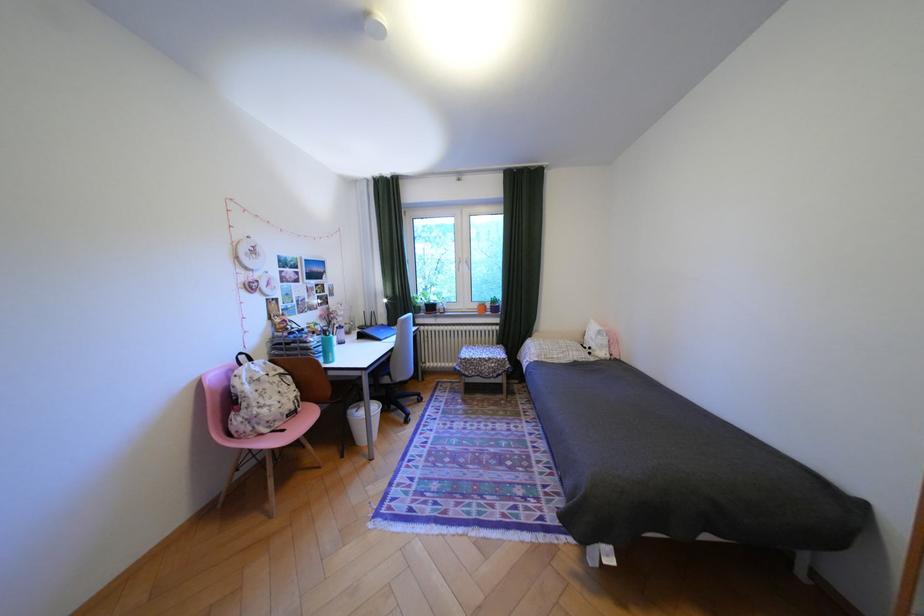
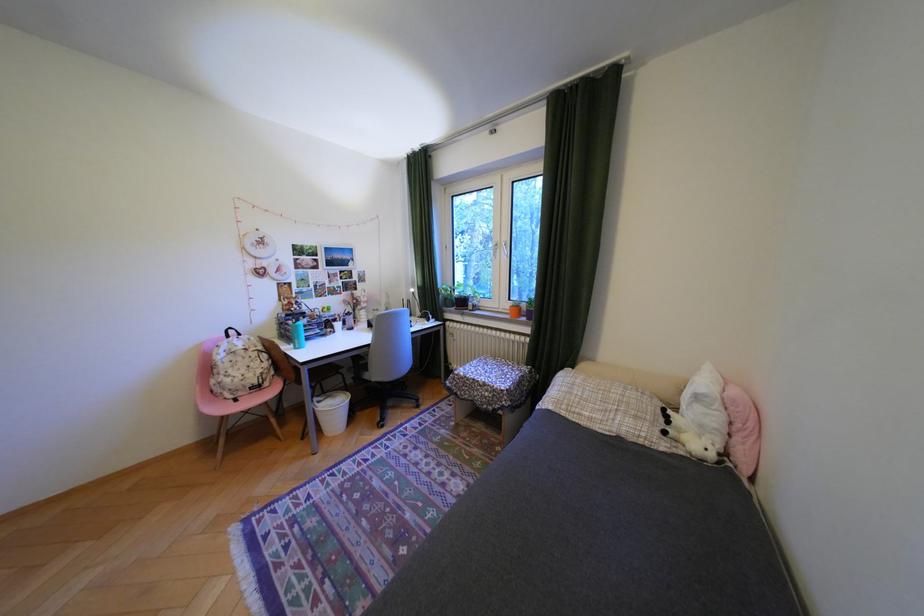
Where in the second image is the point corresponding to pixel 612 338 from the first image?

(710, 408)